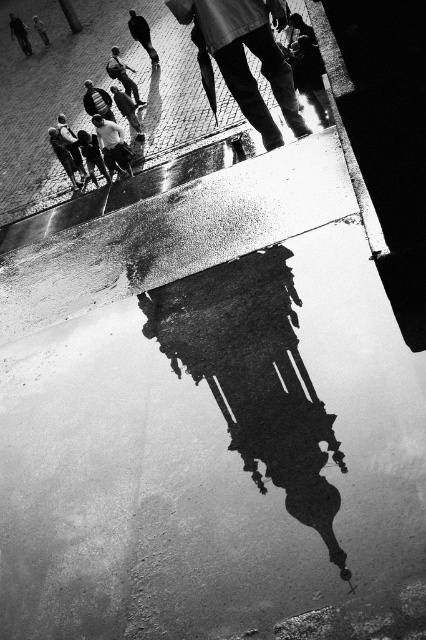
Question: Does white cotton shirt at center have a smaller size compared to smooth leather shoe at center?

Choices:
 (A) yes
 (B) no

Answer: (A)

Question: Is white cotton shirt at center further to the viewer compared to matte black helmet at center?

Choices:
 (A) no
 (B) yes

Answer: (A)

Question: Which point is farther to the camera?

Choices:
 (A) (26, 38)
 (B) (114, 92)
 (C) (45, 32)
 (D) (104, 93)

Answer: (A)

Question: Which of the following is the farthest from the observer?

Choices:
 (A) matte black helmet at center
 (B) smooth leather shoe at center
 (C) smooth skin person at upper left

Answer: (C)

Question: Which object is positioned farthest from the smooth leather shoe at center?

Choices:
 (A) dark gray jeans at center
 (B) matte black helmet at center
 (C) matte black jacket at center
 (D) matte white shirt at lower left

Answer: (D)

Question: Does white cotton shirt at center lie behind matte white shirt at lower left?

Choices:
 (A) yes
 (B) no

Answer: (B)